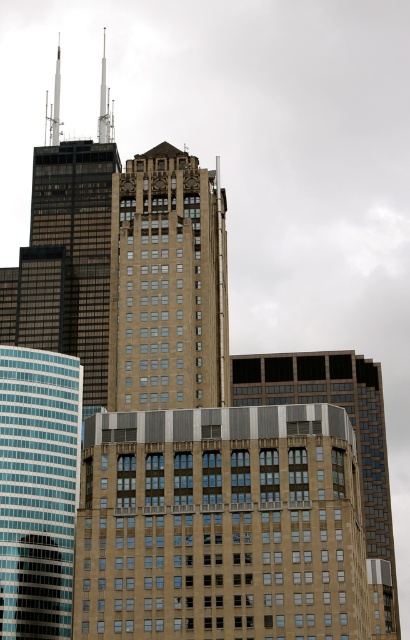
Does beige stone tower at center lie in front of brown glass building at center?

A: Yes, it is.

Is beige stone tower at center to the right of brown glass building at center from the viewer's perspective?

In fact, beige stone tower at center is to the left of brown glass building at center.

Describe the element at coordinates (168, 284) in the screenshot. Image resolution: width=410 pixels, height=640 pixels. I see `beige stone tower at center` at that location.

I want to click on beige stone tower at center, so click(168, 284).

Who is more forward, (118, 225) or (4, 595)?

Positioned in front is point (118, 225).

Is beige stone tower at center to the left of matte glass skyscraper at left from the viewer's perspective?

Result: In fact, beige stone tower at center is to the right of matte glass skyscraper at left.

Which is behind, point (175, 256) or point (36, 524)?

The point (36, 524) is behind.

In order to click on beige stone tower at center in this screenshot , I will do `click(168, 284)`.

From the picture: Is matte glass skyscraper at left shorter than brown glass building at center?

Indeed, matte glass skyscraper at left has a lesser height compared to brown glass building at center.

Does matte glass skyscraper at left have a lesser width compared to brown glass building at center?

Correct, matte glass skyscraper at left's width is less than brown glass building at center's.

Which is in front, point (8, 576) or point (369, 420)?

Point (8, 576) is in front.

I want to click on matte glass skyscraper at left, so point(38,490).